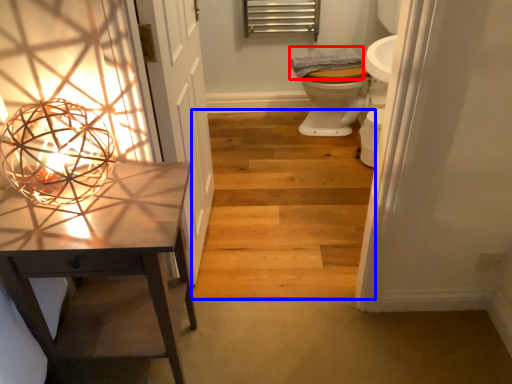
Question: Which of the following is the closest to the observer, material (highlighted by a red box) or stairwell (highlighted by a blue box)?

Choices:
 (A) material
 (B) stairwell

Answer: (B)